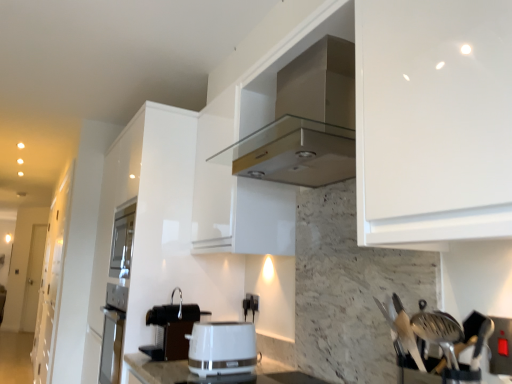
This screenshot has width=512, height=384. Describe the element at coordinates (436, 343) in the screenshot. I see `metallic silver utensils at right` at that location.

Locate an element on the screen. The width and height of the screenshot is (512, 384). white glossy toaster at center is located at coordinates (222, 348).

In order to face black plastic coffee machine at lower center, should I rotate leftwards or rightwards?

To face it directly, rotate left by 11.704 degrees.

Where is `white glossy cabinet at left`? Image resolution: width=512 pixels, height=384 pixels. white glossy cabinet at left is located at coordinates (52, 281).

From a real-world perspective, between white glossy toaster at center and white glossy cabinet at left, who is vertically lower?

white glossy toaster at center.

Is point (200, 368) positioned before point (51, 212)?

That is True.

Is white glossy toaster at center bigger or smaller than white glossy cabinet at left?

In the image, white glossy toaster at center appears to be smaller than white glossy cabinet at left.

From the image's perspective, which one is positioned lower, white glossy toaster at center or white glossy cabinet at left?

From the image's view, white glossy cabinet at left is below.

This screenshot has height=384, width=512. Find the location of `electric outlet in front of the white glossy cabinet at left`. electric outlet in front of the white glossy cabinet at left is located at coordinates (251, 302).

Is black plastic electric outlet at center not close to white glossy cabinet at left?

That's right, there is a large distance between black plastic electric outlet at center and white glossy cabinet at left.

Can you confirm if black plastic electric outlet at center is positioned to the right of white glossy cabinet at left?

Correct, you'll find black plastic electric outlet at center to the right of white glossy cabinet at left.

Which is more to the left, white glossy cabinet at left or metallic silver utensils at right?

Positioned to the left is white glossy cabinet at left.

Who is taller, white glossy cabinet at left or metallic silver utensils at right?

Standing taller between the two is white glossy cabinet at left.

From a real-world perspective, is white glossy cabinet at left located beneath metallic silver utensils at right?

Indeed, from a real-world perspective, white glossy cabinet at left is positioned beneath metallic silver utensils at right.

Would you say white glossy cabinet at left is outside metallic silver utensils at right?

white glossy cabinet at left lies outside metallic silver utensils at right's area.

Does black plastic coffee machine at lower center turn towards white glossy cabinet at left?

No.

Which of these two, black plastic coffee machine at lower center or white glossy cabinet at left, is thinner?

black plastic coffee machine at lower center is thinner.

Identify the location of coffee machine in front of the white glossy cabinet at left. (172, 329).

Which is in front, point (170, 319) or point (56, 223)?

The point (170, 319) is closer.

Is white glossy toaster at center positioned beyond the bounds of black plastic coffee machine at lower center?

Yes, white glossy toaster at center is not within black plastic coffee machine at lower center.

From the image's perspective, does white glossy toaster at center appear lower than black plastic coffee machine at lower center?

Indeed, from the image's perspective, white glossy toaster at center is shown beneath black plastic coffee machine at lower center.

Can you confirm if white glossy toaster at center is thinner than black plastic coffee machine at lower center?

No, white glossy toaster at center is not thinner than black plastic coffee machine at lower center.

Is white glossy toaster at center beside black plastic coffee machine at lower center?

white glossy toaster at center and black plastic coffee machine at lower center are clearly separated.

Does white glossy cabinet at left turn towards black plastic coffee machine at lower center?

No, white glossy cabinet at left is not aimed at black plastic coffee machine at lower center.

Considering the positions of objects white glossy cabinet at left and black plastic coffee machine at lower center in the image provided, who is more to the left, white glossy cabinet at left or black plastic coffee machine at lower center?

white glossy cabinet at left.

Who is shorter, white glossy cabinet at left or black plastic coffee machine at lower center?

black plastic coffee machine at lower center.

Is white glossy cabinet at left positioned beyond the bounds of black plastic coffee machine at lower center?

Indeed, white glossy cabinet at left is completely outside black plastic coffee machine at lower center.

Is black plastic electric outlet at center closer to the viewer compared to metallic silver utensils at right?

No, black plastic electric outlet at center is further to the viewer.

From the image's perspective, is black plastic electric outlet at center under metallic silver utensils at right?

Yes.

Is black plastic electric outlet at center bigger or smaller than metallic silver utensils at right?

In the image, black plastic electric outlet at center appears to be smaller than metallic silver utensils at right.

Where is `silverware that appears on the right of black plastic electric outlet at center`? The width and height of the screenshot is (512, 384). silverware that appears on the right of black plastic electric outlet at center is located at coordinates (436, 343).

Where is `cabinetry that appears behind the white glossy toaster at center`? This screenshot has width=512, height=384. cabinetry that appears behind the white glossy toaster at center is located at coordinates (52, 281).

Where is `electric outlet that is above the white glossy cabinet at left (from the image's perspective)`? This screenshot has width=512, height=384. electric outlet that is above the white glossy cabinet at left (from the image's perspective) is located at coordinates (251, 302).

In the scene shown: Looking at the image, which one is located closer to black plastic coffee machine at lower center, black plastic electric outlet at center or white glossy toaster at center?

white glossy toaster at center is closer to black plastic coffee machine at lower center.

Estimate the real-world distances between objects in this image. Which object is further from black plastic electric outlet at center, black plastic coffee machine at lower center or white glossy toaster at center?

Among the two, white glossy toaster at center is located further to black plastic electric outlet at center.

Estimate the real-world distances between objects in this image. Which object is closer to white glossy cabinet at left, white glossy toaster at center or metallic silver utensils at right?

Based on the image, white glossy toaster at center appears to be nearer to white glossy cabinet at left.

Looking at the image, which one is located further to white glossy cabinet at left, metallic silver utensils at right or white glossy toaster at center?

metallic silver utensils at right.

Based on their spatial positions, is white glossy cabinet at left or metallic silver utensils at right closer to black plastic coffee machine at lower center?

metallic silver utensils at right is closer to black plastic coffee machine at lower center.

Considering their positions, is black plastic electric outlet at center positioned further to black plastic coffee machine at lower center than metallic silver utensils at right?

The object further to black plastic coffee machine at lower center is metallic silver utensils at right.

Based on their spatial positions, is black plastic electric outlet at center or white glossy cabinet at left closer to white glossy toaster at center?

Based on the image, black plastic electric outlet at center appears to be nearer to white glossy toaster at center.

Looking at the image, which one is located closer to metallic silver utensils at right, white glossy toaster at center or black plastic coffee machine at lower center?

Based on the image, white glossy toaster at center appears to be nearer to metallic silver utensils at right.

Find the location of a particular element. This screenshot has height=384, width=512. kitchen appliance between metallic silver utensils at right and black plastic coffee machine at lower center in the front-back direction is located at coordinates (222, 348).

Where is `coffee machine between white glossy cabinet at left and white glossy toaster at center from left to right`? This screenshot has height=384, width=512. coffee machine between white glossy cabinet at left and white glossy toaster at center from left to right is located at coordinates (172, 329).

Identify the location of kitchen appliance between white glossy cabinet at left and black plastic electric outlet at center. (222, 348).

The image size is (512, 384). What are the coordinates of `electric outlet between white glossy cabinet at left and metallic silver utensils at right` in the screenshot? It's located at (251, 302).